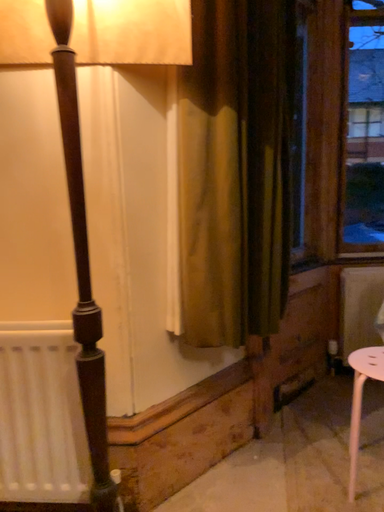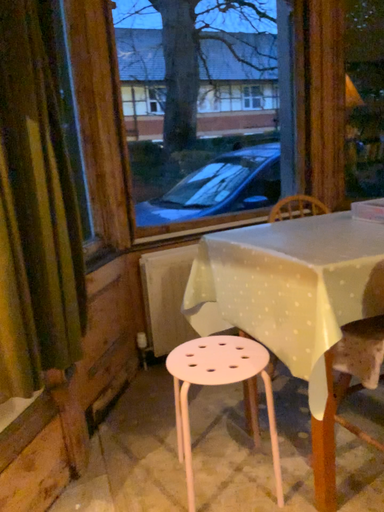
Question: How did the camera likely rotate when shooting the video?

Choices:
 (A) rotated right
 (B) rotated left

Answer: (A)